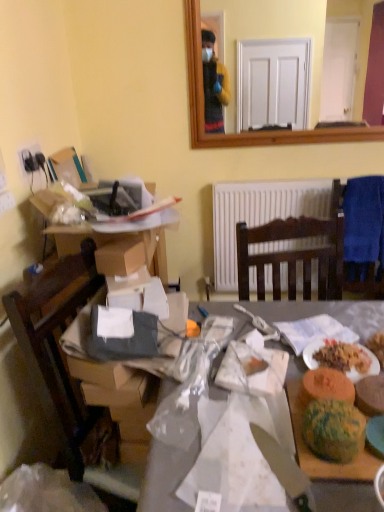
The image size is (384, 512). What are the coordinates of `free point below white paper at center (from a real-world perspective)` in the screenshot? It's located at (239, 460).